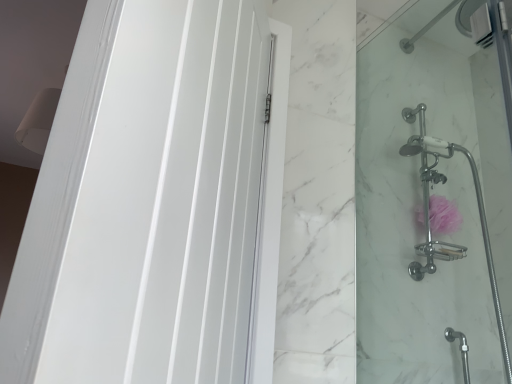
What do you see at coordinates (166, 202) in the screenshot?
I see `white glossy door at left` at bounding box center [166, 202].

The image size is (512, 384). Identify the location of pink fabric sponge at right. (443, 215).

At what (x,y) coordinates should I click in order to perform the action: click on white glossy door at left. Please return your answer as a coordinate pair (x, y). This screenshot has width=512, height=384. Looking at the image, I should click on (166, 202).

What's the angular difference between pink fabric sponge at right and white glossy door at left's facing directions?

pink fabric sponge at right and white glossy door at left are facing 121 degrees away from each other.

Considering the positions of point (419, 209) and point (162, 117), is point (419, 209) closer or farther from the camera than point (162, 117)?

Point (419, 209) is farther from the camera than point (162, 117).

From the picture: Is pink fabric sponge at right bigger or smaller than white glossy door at left?

Clearly, pink fabric sponge at right is smaller in size than white glossy door at left.

Considering the relative sizes of pink fabric sponge at right and white glossy door at left in the image provided, is pink fabric sponge at right thinner than white glossy door at left?

Indeed, pink fabric sponge at right has a lesser width compared to white glossy door at left.

Can clear glass shower door at right be found inside white glossy door at left?

That's incorrect, clear glass shower door at right is not inside white glossy door at left.

Which is in front, point (210, 67) or point (382, 379)?

The point (210, 67) is closer to the camera.

Which of these two, white glossy door at left or clear glass shower door at right, is bigger?

Bigger between the two is clear glass shower door at right.

From a real-world perspective, is white glossy door at left on top of clear glass shower door at right?

No.

At what (x,y) coordinates should I click in order to perform the action: click on flower above the white glossy door at left (from a real-world perspective). Please return your answer as a coordinate pair (x, y). The image size is (512, 384). Looking at the image, I should click on (443, 215).

Is white glossy door at left looking in the opposite direction of pink fabric sponge at right?

That's not correct — white glossy door at left is not looking away from pink fabric sponge at right.

Who is bigger, white glossy door at left or pink fabric sponge at right?

Bigger between the two is white glossy door at left.

From their relative heights in the image, would you say white glossy door at left is taller or shorter than pink fabric sponge at right?

white glossy door at left is taller than pink fabric sponge at right.

Is pink fabric sponge at right smaller than clear glass shower door at right?

Correct, pink fabric sponge at right occupies less space than clear glass shower door at right.

Which object is wider, pink fabric sponge at right or clear glass shower door at right?

pink fabric sponge at right.

From a real-world perspective, is pink fabric sponge at right beneath clear glass shower door at right?

Answer: Incorrect, from a real-world perspective, pink fabric sponge at right is higher than clear glass shower door at right.

Which is behind, point (447, 222) or point (386, 228)?

The point (386, 228) is behind.

Is clear glass shower door at right oriented away from pink fabric sponge at right?

Correct, clear glass shower door at right is looking away from pink fabric sponge at right.

Is clear glass shower door at right located outside pink fabric sponge at right?

clear glass shower door at right is positioned outside pink fabric sponge at right.

Which object is closer to the camera, clear glass shower door at right or pink fabric sponge at right?

clear glass shower door at right is closer to the camera.

Find the location of a particular element. shower door behind the white glossy door at left is located at coordinates pyautogui.click(x=428, y=203).

Between clear glass shower door at right and white glossy door at left, which one has smaller size?

With smaller size is white glossy door at left.

From the image's perspective, who appears lower, clear glass shower door at right or white glossy door at left?

clear glass shower door at right is shown below in the image.

Where is `flower behind the white glossy door at left`? This screenshot has height=384, width=512. flower behind the white glossy door at left is located at coordinates click(x=443, y=215).

In order to click on screen door that appears above the clear glass shower door at right (from the image's perspective) in this screenshot , I will do `click(166, 202)`.

Considering their positions, is white glossy door at left positioned further to clear glass shower door at right than pink fabric sponge at right?

white glossy door at left is positioned further to the anchor clear glass shower door at right.

From the image, which object appears to be farther from clear glass shower door at right, pink fabric sponge at right or white glossy door at left?

white glossy door at left.

Looking at the image, which one is located closer to pink fabric sponge at right, clear glass shower door at right or white glossy door at left?

Based on the image, clear glass shower door at right appears to be nearer to pink fabric sponge at right.

Considering their positions, is white glossy door at left positioned closer to pink fabric sponge at right than clear glass shower door at right?

The object closer to pink fabric sponge at right is clear glass shower door at right.

When comparing their distances from white glossy door at left, does clear glass shower door at right or pink fabric sponge at right seem closer?

clear glass shower door at right is positioned closer to the anchor white glossy door at left.

When comparing their distances from white glossy door at left, does pink fabric sponge at right or clear glass shower door at right seem closer?

Among the two, clear glass shower door at right is located nearer to white glossy door at left.

The height and width of the screenshot is (384, 512). What are the coordinates of `shower door located between white glossy door at left and pink fabric sponge at right in the depth direction` in the screenshot? It's located at (428, 203).